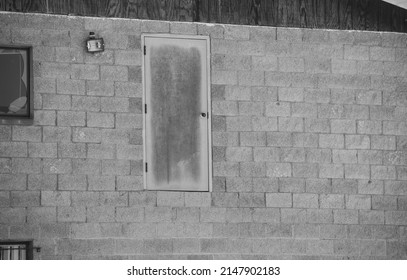
This screenshot has height=280, width=407. Find the location of `handle`. handle is located at coordinates (203, 114).